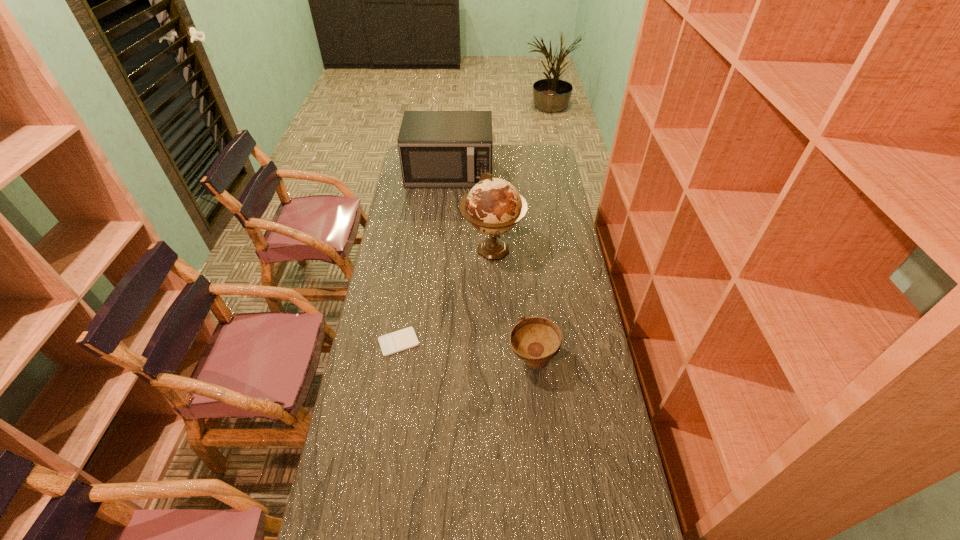
Identify the location of globe. This screenshot has width=960, height=540. (494, 206).

You are a GUI agent. You are given a task and a screenshot of the screen. Output one action in this format:
    pyautogui.click(x=<x>, y=<y>)
    Task: Click on the third nearest object
    This screenshot has width=960, height=540.
    Given the screenshot: What is the action you would take?
    click(494, 206)

Find the location of a particular element. The height and width of the screenshot is (540, 960). microwave oven is located at coordinates coord(438,149).

You are a GUI agent. You are given a task and a screenshot of the screen. Output one action in this format:
    pyautogui.click(x=<x>, y=<y>)
    Task: Click on the farthest object
    This screenshot has height=540, width=960.
    Given the screenshot: What is the action you would take?
    pyautogui.click(x=438, y=149)

What are the coordinates of `the second shortest object` in the screenshot? It's located at (536, 340).

The height and width of the screenshot is (540, 960). I want to click on the shortest object, so click(400, 340).

The height and width of the screenshot is (540, 960). In order to click on free space located 0.150m on the front of the tallest object showing Asia in this screenshot , I will do `click(493, 301)`.

At what (x,y) coordinates should I click in order to perform the action: click on vacant space located 0.390m on the front-facing side of the microwave oven. Please return your answer as a coordinate pair (x, y). Image resolution: width=960 pixels, height=540 pixels. Looking at the image, I should click on (443, 248).

This screenshot has width=960, height=540. What are the coordinates of `vacant region located on the right of the second shortest object` in the screenshot? It's located at (588, 360).

Locate an element on the screen. This screenshot has width=960, height=540. vacant space located 0.210m on the back of the shortest object is located at coordinates (408, 284).